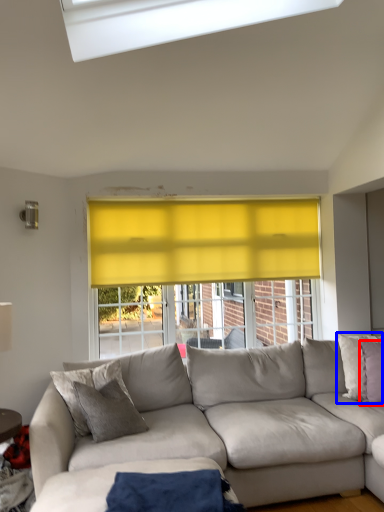
Question: Which of the following is the farthest to the observer, pillow (highlighted by a red box) or pillow (highlighted by a blue box)?

Choices:
 (A) pillow
 (B) pillow

Answer: (B)